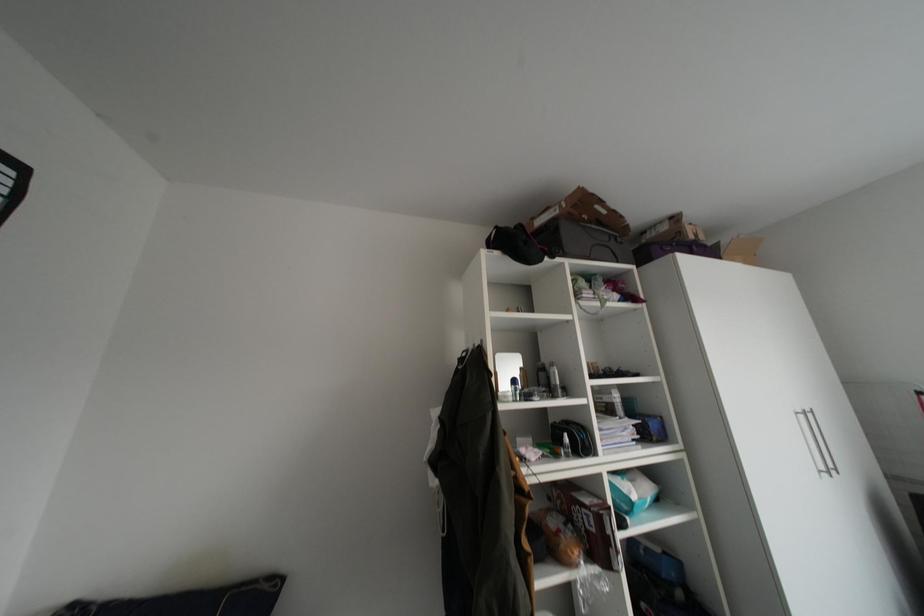
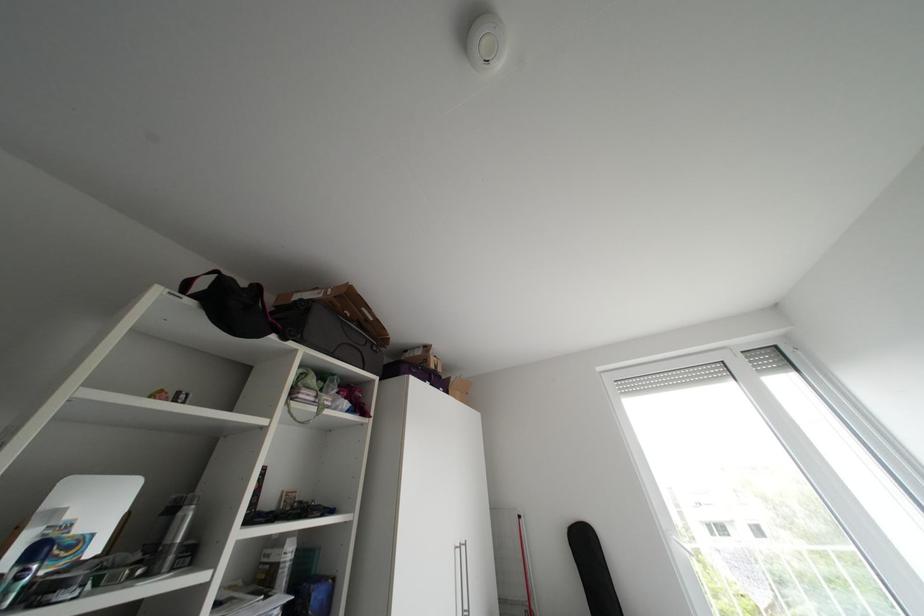
The first image is from the beginning of the video and the second image is from the end. How did the camera likely rotate when shooting the video?

The camera's rotation is toward right-up.